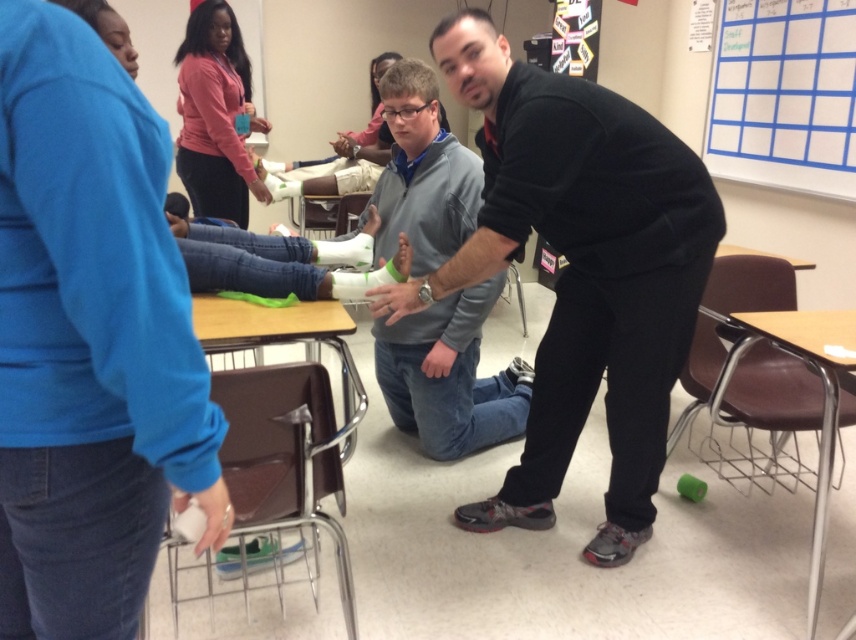
From the picture: You are a student in the classroom and need to locate the white paperboard at upper right. Which direction should you look relative to the black matte shirt at center?

The white paperboard at upper right is located to the right of the black matte shirt at center, so you should look to the right side of the black matte shirt at center to find it.

You are standing in the classroom and want to hand a document to the person wearing the black matte shirt at center. According to the image, where should you walk to find them?

The black matte shirt at center is located at point 0.423 on the horizontal axis and 0.676 on the vertical axis, so you should walk towards that coordinate to find them.